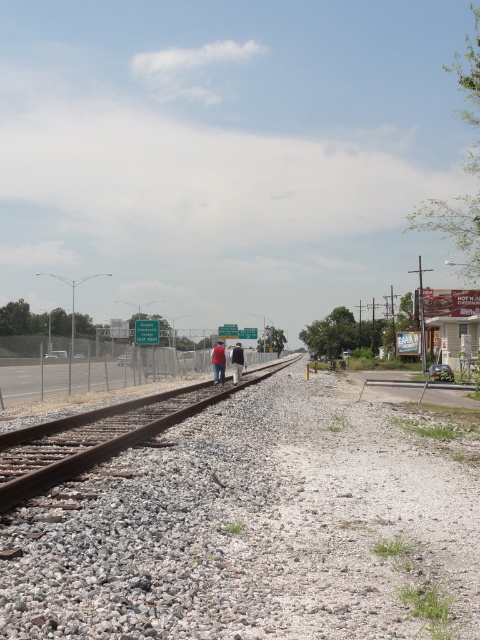
Question: In this image, where is brown metal train track at center located relative to reddish-brown leather jacket at center?

Choices:
 (A) right
 (B) left

Answer: (A)

Question: Which point is closer to the camera taking this photo?

Choices:
 (A) (214, 365)
 (B) (233, 371)
 (C) (128, 440)
 (D) (214, 349)

Answer: (C)

Question: Does reddish-brown leather jacket at center have a greater width compared to dark blue jacket at center?

Choices:
 (A) yes
 (B) no

Answer: (A)

Question: Which point appears farthest from the camera in this image?

Choices:
 (A) (237, 376)
 (B) (41, 490)
 (C) (213, 355)
 (D) (236, 384)

Answer: (C)

Question: Which object is the closest to the reddish-brown leather jacket at center?

Choices:
 (A) dark blue jacket at center
 (B) red matte jacket at center

Answer: (B)

Question: Observing the image, what is the correct spatial positioning of brown metal train track at center in reference to reddish-brown leather jacket at center?

Choices:
 (A) right
 (B) left

Answer: (A)